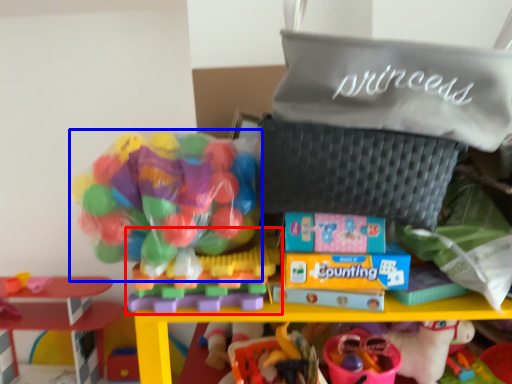
Question: Which object is further to the camera taking this photo, toy (highlighted by a red box) or toy (highlighted by a blue box)?

Choices:
 (A) toy
 (B) toy

Answer: (A)